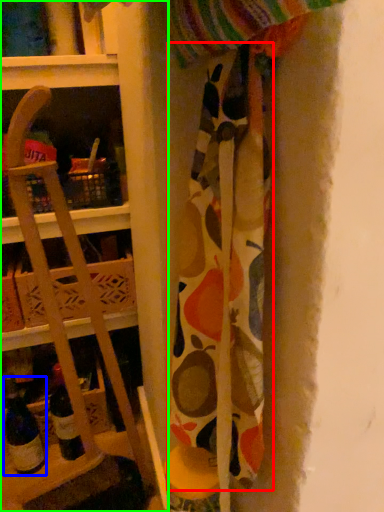
Question: Which is farther away from fabric (highlighted by a red box)? wine bottle (highlighted by a blue box) or shelf (highlighted by a green box)?

Choices:
 (A) wine bottle
 (B) shelf

Answer: (A)